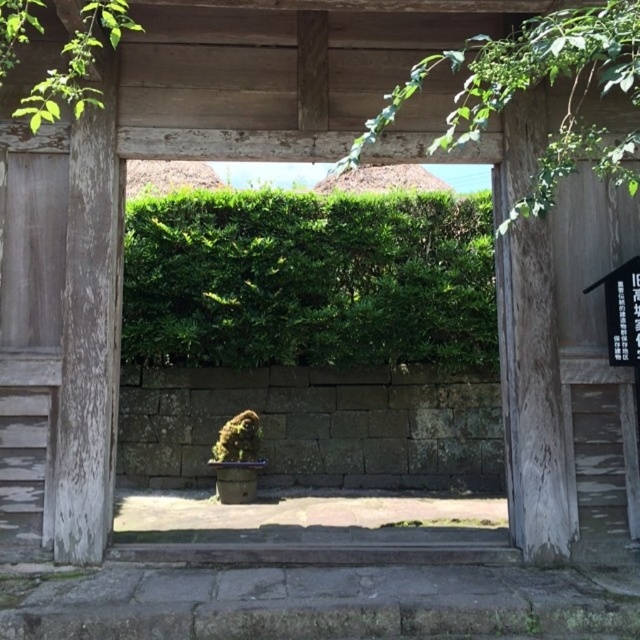
Does green leafy hedge at center have a smaller size compared to green leafy hedge at upper center?

No.

In the scene shown: Is green leafy hedge at center thinner than green leafy hedge at upper center?

In fact, green leafy hedge at center might be wider than green leafy hedge at upper center.

Which is behind, point (323, 353) or point (188, 352)?

Positioned behind is point (323, 353).

Locate an element on the screen. This screenshot has height=640, width=640. green leafy hedge at center is located at coordinates (317, 371).